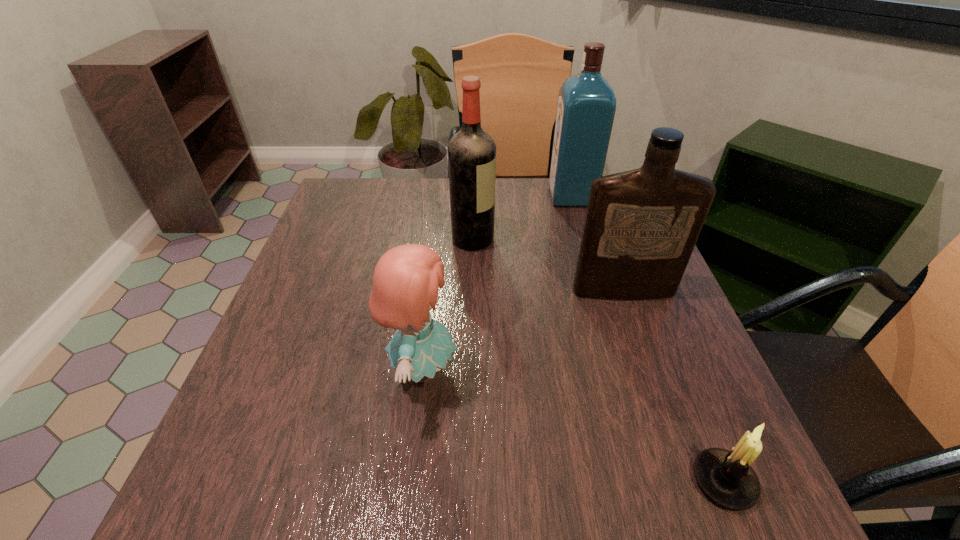
Locate an element on the screen. Image resolution: width=960 pixels, height=540 pixels. the farthest liquor is located at coordinates (586, 107).

The width and height of the screenshot is (960, 540). I want to click on the second farthest object, so click(471, 152).

This screenshot has height=540, width=960. What are the coordinates of `the leftmost liquor` in the screenshot? It's located at [x=471, y=152].

Identify the location of the third nearest object. (641, 226).

Locate an element on the screen. This screenshot has height=540, width=960. the second nearest object is located at coordinates (405, 283).

The height and width of the screenshot is (540, 960). What are the coordinates of `doll` in the screenshot? It's located at (405, 283).

I want to click on the nearest object, so click(726, 477).

This screenshot has height=540, width=960. In order to click on candle holder in this screenshot , I will do `click(726, 477)`.

Find the location of a particular element. free region located on the flat label side of the farthest liquor is located at coordinates (492, 197).

Where is `free location located on the flat label side of the farthest liquor`? free location located on the flat label side of the farthest liquor is located at coordinates (463, 197).